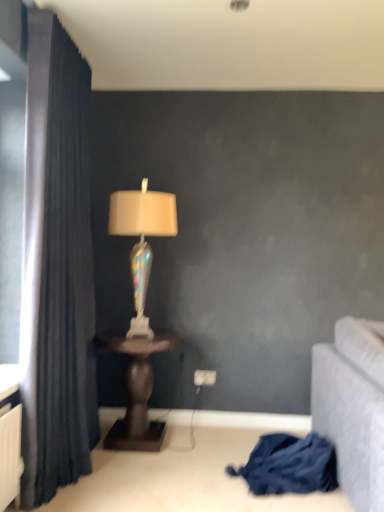
Question: Does brown wooden table at center come behind blue fabric at lower right?

Choices:
 (A) no
 (B) yes

Answer: (B)

Question: Can you confirm if brown wooden table at center is thinner than blue fabric at lower right?

Choices:
 (A) no
 (B) yes

Answer: (A)

Question: Considering the relative sizes of brown wooden table at center and blue fabric at lower right in the image provided, is brown wooden table at center wider than blue fabric at lower right?

Choices:
 (A) yes
 (B) no

Answer: (A)

Question: Does brown wooden table at center have a greater height compared to blue fabric at lower right?

Choices:
 (A) no
 (B) yes

Answer: (B)

Question: Is brown wooden table at center far away from blue fabric at lower right?

Choices:
 (A) yes
 (B) no

Answer: (B)

Question: From a real-world perspective, is blue fabric at lower right physically located above or below dark blue fabric curtain at left?

Choices:
 (A) below
 (B) above

Answer: (A)

Question: Is blue fabric at lower right in front of or behind dark blue fabric curtain at left in the image?

Choices:
 (A) front
 (B) behind

Answer: (B)

Question: From the image's perspective, relative to dark blue fabric curtain at left, is blue fabric at lower right above or below?

Choices:
 (A) above
 (B) below

Answer: (B)

Question: Considering the positions of blue fabric at lower right and dark blue fabric curtain at left in the image, is blue fabric at lower right bigger or smaller than dark blue fabric curtain at left?

Choices:
 (A) small
 (B) big

Answer: (A)

Question: Is point (51, 25) positioned closer to the camera than point (152, 441)?

Choices:
 (A) farther
 (B) closer

Answer: (B)

Question: From the image's perspective, is dark blue fabric curtain at left above or below brown wooden table at center?

Choices:
 (A) above
 (B) below

Answer: (A)

Question: Considering the positions of dark blue fabric curtain at left and brown wooden table at center in the image, is dark blue fabric curtain at left taller or shorter than brown wooden table at center?

Choices:
 (A) short
 (B) tall

Answer: (B)

Question: Based on their sizes in the image, would you say dark blue fabric curtain at left is bigger or smaller than brown wooden table at center?

Choices:
 (A) small
 (B) big

Answer: (B)

Question: In the image, is blue fabric at lower right on the left side or the right side of brown wooden table at center?

Choices:
 (A) left
 (B) right

Answer: (B)

Question: Is point (306, 482) closer or farther from the camera than point (140, 420)?

Choices:
 (A) farther
 (B) closer

Answer: (B)